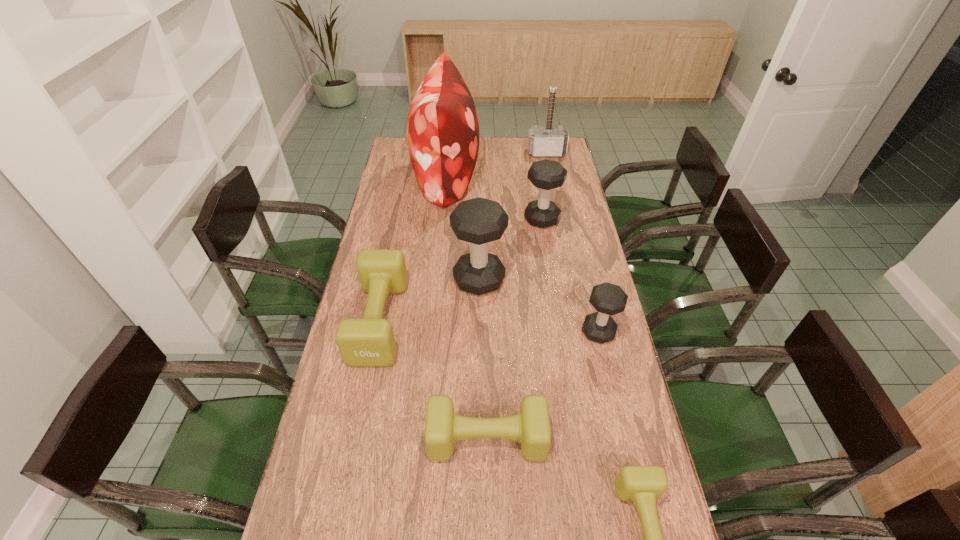
Find the location of a particular element. The image size is (960, 540). the fifth farthest dumbbell is located at coordinates (531, 427).

At what (x,y) coordinates should I click in order to perform the action: click on the second olive dumbbell from left to right. Please return your answer as a coordinate pair (x, y). Looking at the image, I should click on (531, 427).

I want to click on vacant space located on the front-facing side of the tallest object, so click(x=497, y=177).

Find the location of a particular element. This screenshot has height=540, width=960. vacant space situated 0.180m for striking with the head of the hammer is located at coordinates (552, 180).

This screenshot has width=960, height=540. In order to click on vacant position located on the back of the leftmost gray dumbbell in this screenshot , I will do `click(479, 247)`.

Image resolution: width=960 pixels, height=540 pixels. What are the coordinates of `free region located 0.190m on the left of the fourth tallest object` in the screenshot? It's located at (477, 219).

In order to click on vacant area located 0.200m on the left of the smallest gray dumbbell in this screenshot , I will do `click(517, 332)`.

You are a GUI agent. You are given a task and a screenshot of the screen. Output one action in this format:
    pyautogui.click(x=<x>, y=<y>)
    Task: Click on the vacant region located on the right of the leftmost dumbbell
    The height and width of the screenshot is (540, 960).
    Given the screenshot: What is the action you would take?
    pyautogui.click(x=477, y=321)

Find the location of a particular element. free space located on the back of the second olive dumbbell from left to right is located at coordinates (486, 349).

I want to click on cushion that is at the far edge, so click(x=442, y=129).